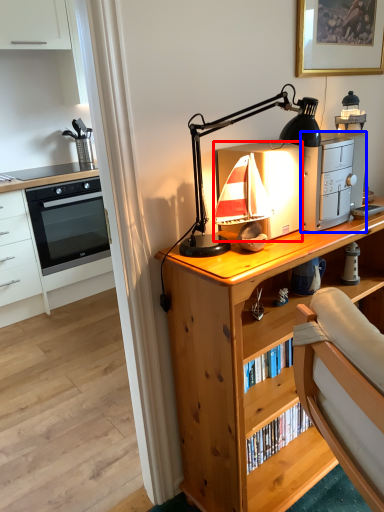
Question: Which object appears farthest to the camera in this image, appliance (highlighted by a red box) or appliance (highlighted by a blue box)?

Choices:
 (A) appliance
 (B) appliance

Answer: (B)